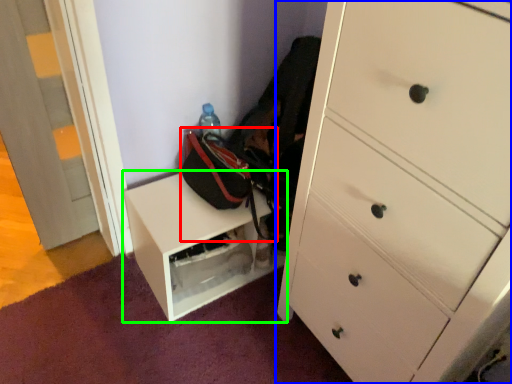
Question: Considering the real-world distances, which object is farthest from messenger bag (highlighted by a red box)? chest of drawers (highlighted by a blue box) or furniture (highlighted by a green box)?

Choices:
 (A) chest of drawers
 (B) furniture

Answer: (A)